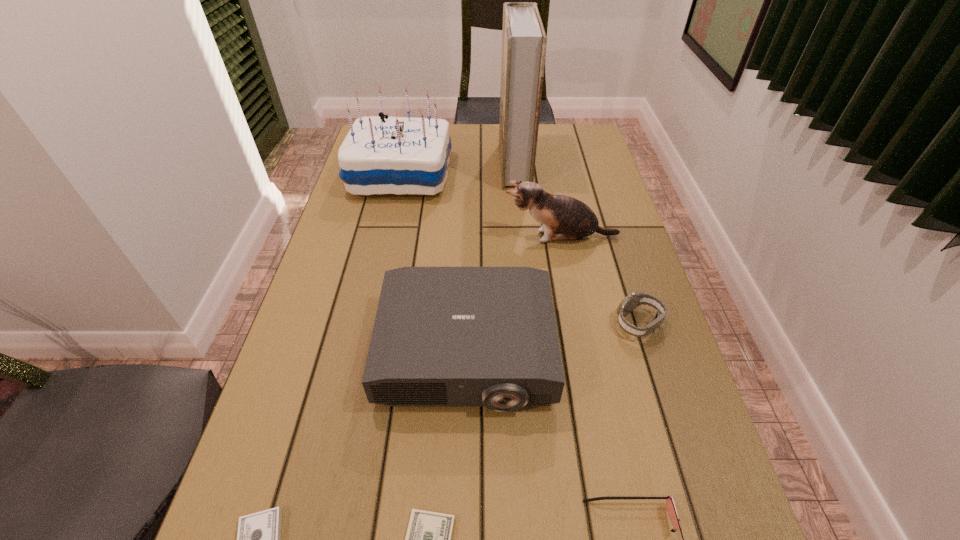
Find the location of a particular element. Image resolution: width=960 pixels, height=540 pixels. phonebook is located at coordinates [x=524, y=41].

Where is `the seventh shortest object`? Image resolution: width=960 pixels, height=540 pixels. the seventh shortest object is located at coordinates 396,155.

The image size is (960, 540). Find the location of `the third tallest object`. the third tallest object is located at coordinates point(563,218).

Locate an element on the screen. the sixth nearest object is located at coordinates (563, 218).

Locate an element on the screen. the fifth shortest object is located at coordinates (443, 336).

Identify the location of watch. This screenshot has width=960, height=540. (x=630, y=302).

Locate an element on the screen. Image resolution: width=960 pixels, height=540 pixels. vacant point located on the cover of the tallest object is located at coordinates (399, 165).

Locate an element on the screen. This screenshot has width=960, height=540. vacant space situated on the cover of the tallest object is located at coordinates (449, 165).

Find the location of `vacant space located 0.320m on the cover of the tallest object`. vacant space located 0.320m on the cover of the tallest object is located at coordinates (405, 165).

Locate an element on the screen. This screenshot has width=960, height=540. free space located 0.100m on the front of the birthday cake is located at coordinates (391, 225).